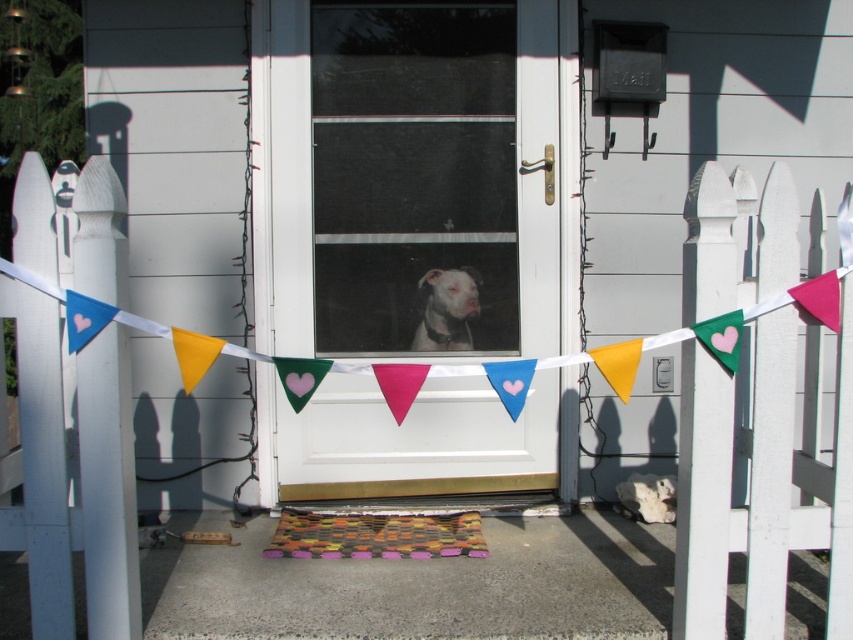
Question: Is multicolored woven mat at center above white matte dog at center?

Choices:
 (A) yes
 (B) no

Answer: (B)

Question: Can you confirm if white glossy screen door at center is wider than multicolored woven mat at center?

Choices:
 (A) yes
 (B) no

Answer: (A)

Question: Is white glossy screen door at center below white matte dog at center?

Choices:
 (A) no
 (B) yes

Answer: (A)

Question: Which point is farther to the camera?

Choices:
 (A) white glossy screen door at center
 (B) multicolored woven mat at center

Answer: (A)

Question: Which object appears farthest from the camera in this image?

Choices:
 (A) white matte dog at center
 (B) white glossy screen door at center
 (C) multicolored woven mat at center

Answer: (A)

Question: Which point is farther to the camera?

Choices:
 (A) multicolored woven mat at center
 (B) white matte dog at center
 (C) white glossy screen door at center

Answer: (B)